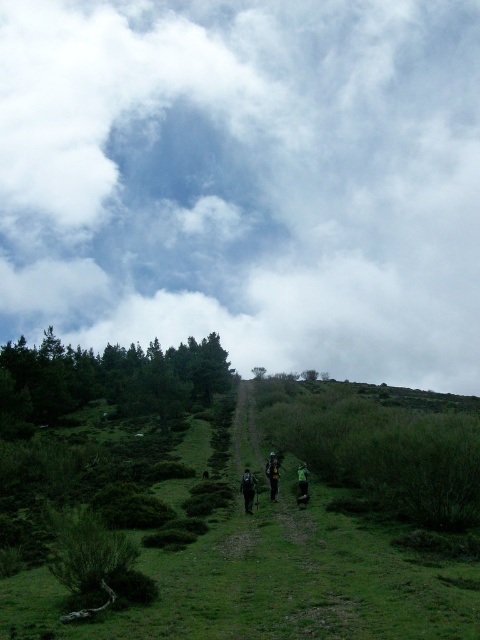
Who is lower down, cloudy sky at upper center or green grassy at center?

green grassy at center is lower down.

I want to click on cloudy sky at upper center, so click(247, 180).

Who is higher up, camouflage fabric backpack at center or green fabric backpack at center?

Positioned higher is green fabric backpack at center.

Does camouflage fabric backpack at center appear on the right side of green fabric backpack at center?

Incorrect, camouflage fabric backpack at center is not on the right side of green fabric backpack at center.

Is point (277, 486) positioned in front of point (300, 474)?

No, (277, 486) is behind (300, 474).

Where is `camouflage fabric backpack at center`? camouflage fabric backpack at center is located at coordinates (x=273, y=476).

Does point (393, 292) come closer to viewer compared to point (308, 481)?

No, (393, 292) is further to viewer.

Is cloudy sky at upper center taller than green fabric backpack at center?

Correct, cloudy sky at upper center is much taller as green fabric backpack at center.

Image resolution: width=480 pixels, height=640 pixels. Identify the location of cloudy sky at upper center. (247, 180).